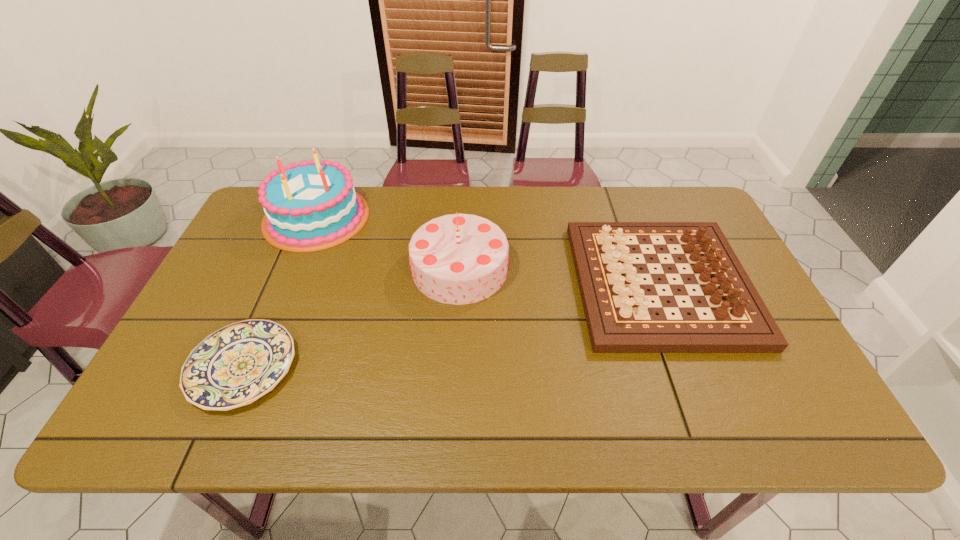
The height and width of the screenshot is (540, 960). In the image, there is a desktop. In order to click on free region at the far edge in this screenshot , I will do `click(408, 191)`.

I want to click on vacant space at the near edge of the desktop, so click(469, 411).

In the image, there is a desktop. Where is `free region at the left edge`? The height and width of the screenshot is (540, 960). free region at the left edge is located at coordinates (234, 253).

Locate an element on the screen. This screenshot has height=540, width=960. vacant space at the right edge of the desktop is located at coordinates (745, 386).

In the image, there is a desktop. Where is `vacant area at the far left corner`? The image size is (960, 540). vacant area at the far left corner is located at coordinates (258, 232).

The width and height of the screenshot is (960, 540). In the image, there is a desktop. Identify the location of free region at the near right corner. (764, 421).

You are a GUI agent. You are given a task and a screenshot of the screen. Output one action in this format:
    pyautogui.click(x=<x>, y=<y>)
    Task: Click on the vacant area between the shortest object and the right birthday cake
    This screenshot has width=960, height=540.
    Given the screenshot: What is the action you would take?
    pyautogui.click(x=351, y=318)

This screenshot has height=540, width=960. What are the coordinates of `free space between the plate and the rightmost object` in the screenshot? It's located at (451, 326).

In order to click on free space between the shortest object and the rightmost object in this screenshot , I will do `click(451, 326)`.

The width and height of the screenshot is (960, 540). I want to click on vacant space that's between the second object from right to left and the plate, so click(x=351, y=318).